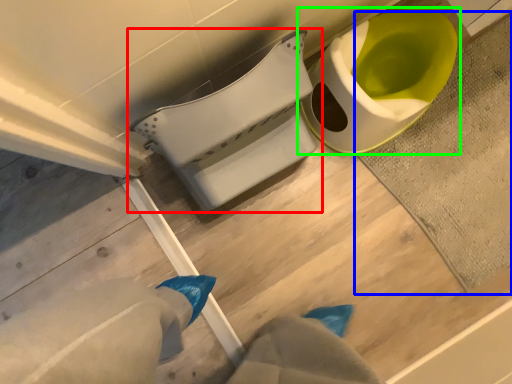
Question: Which object is positioned closest to toilet (highlighted by a red box)? Select from bath mat (highlighted by a blue box) and toilet (highlighted by a green box).

Choices:
 (A) bath mat
 (B) toilet

Answer: (B)